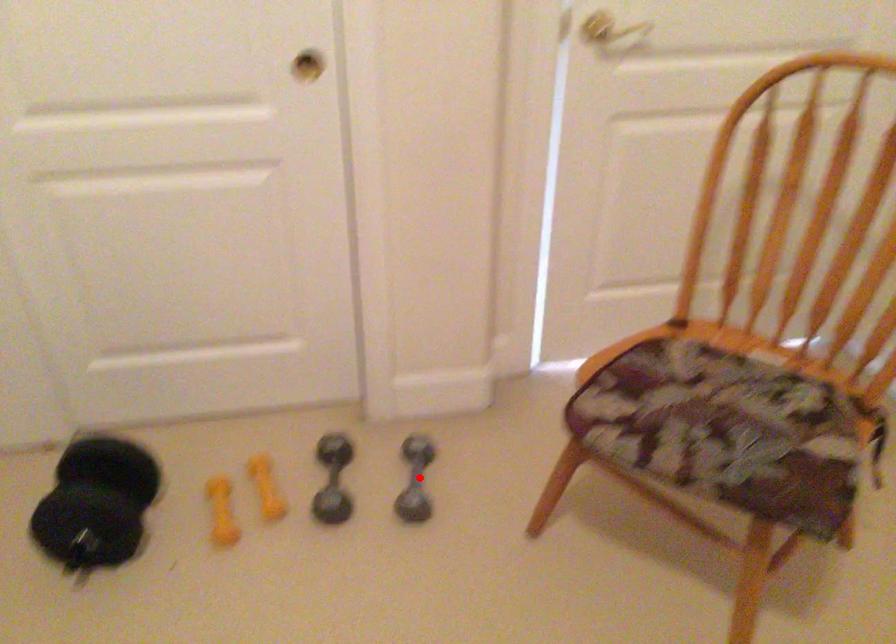
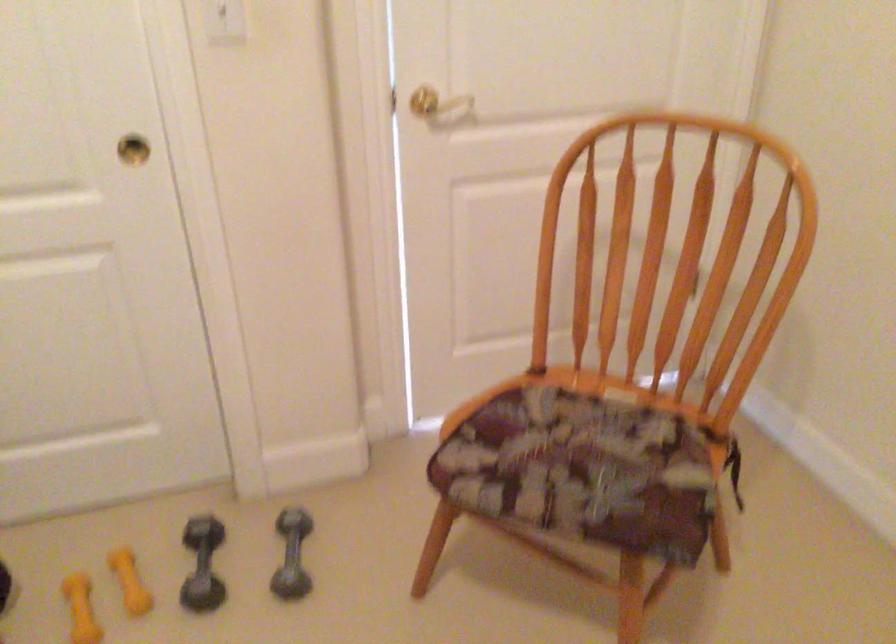
In the second image, find the point that corresponds to the highlighted location in the first image.

(291, 554)